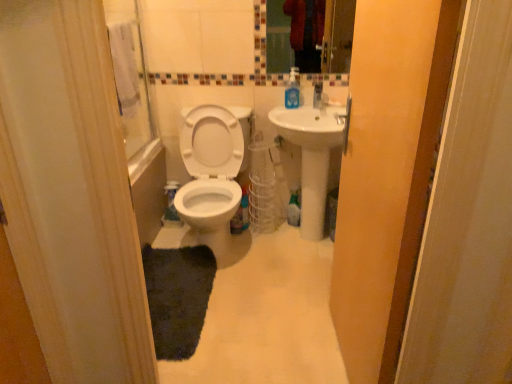
Question: From the image's perspective, is white ceramic sink at center on transparent plastic screen door at upper center?

Choices:
 (A) yes
 (B) no

Answer: (A)

Question: From a real-world perspective, is white ceramic sink at center positioned under transparent plastic screen door at upper center based on gravity?

Choices:
 (A) yes
 (B) no

Answer: (A)

Question: Is white ceramic sink at center taller than transparent plastic screen door at upper center?

Choices:
 (A) yes
 (B) no

Answer: (B)

Question: Are white ceramic sink at center and transparent plastic screen door at upper center making contact?

Choices:
 (A) no
 (B) yes

Answer: (A)

Question: From the image's perspective, is white ceramic sink at center beneath transparent plastic screen door at upper center?

Choices:
 (A) no
 (B) yes

Answer: (A)

Question: Is white ceramic sink at center far from transparent plastic screen door at upper center?

Choices:
 (A) yes
 (B) no

Answer: (B)

Question: Considering the relative sizes of white matte toilet at center and blue translucent soap dispenser at upper right in the image provided, is white matte toilet at center taller than blue translucent soap dispenser at upper right?

Choices:
 (A) yes
 (B) no

Answer: (B)

Question: From a real-world perspective, is white matte toilet at center below blue translucent soap dispenser at upper right?

Choices:
 (A) yes
 (B) no

Answer: (A)

Question: Is white matte toilet at center bigger than blue translucent soap dispenser at upper right?

Choices:
 (A) yes
 (B) no

Answer: (A)

Question: Is white matte toilet at center positioned with its back to blue translucent soap dispenser at upper right?

Choices:
 (A) yes
 (B) no

Answer: (B)

Question: Is blue translucent soap dispenser at upper right completely or partially inside white matte toilet at center?

Choices:
 (A) yes
 (B) no

Answer: (B)

Question: Is white matte toilet at center shorter than blue translucent soap dispenser at upper right?

Choices:
 (A) yes
 (B) no

Answer: (A)

Question: Is white ceramic sink at center taller than matte glass mirror at upper center?

Choices:
 (A) no
 (B) yes

Answer: (B)